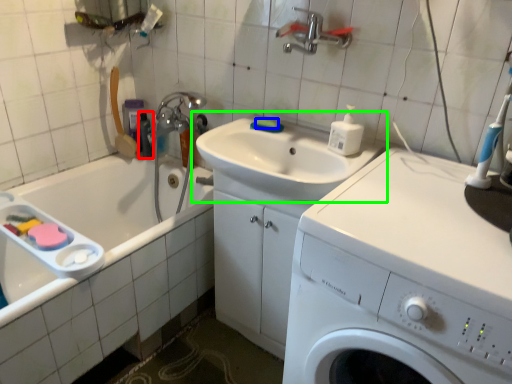
Question: Which is farther away from toiletry (highlighted by a red box)? soap (highlighted by a blue box) or sink (highlighted by a green box)?

Choices:
 (A) soap
 (B) sink

Answer: (B)